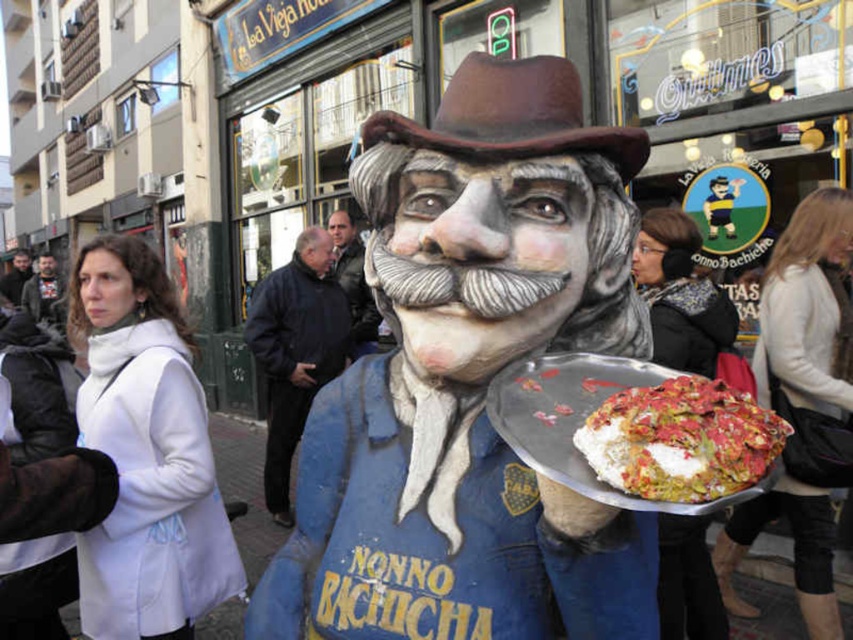
Question: Estimate the real-world distances between objects in this image. Which object is farther from the matte blue statue at center?

Choices:
 (A) white creamy pizza at center
 (B) white sweater at center
 (C) dark brown leather jacket at center
 (D) dark gray fabric jacket at left

Answer: (C)

Question: Can you confirm if smooth leather jacket at center is positioned below dark brown leather jacket at center?

Choices:
 (A) no
 (B) yes

Answer: (B)

Question: Which point is farther to the camera?

Choices:
 (A) (486, 70)
 (B) (697, 472)

Answer: (A)

Question: Where is white woolen coat at left located in relation to white creamy pizza at center in the image?

Choices:
 (A) left
 (B) right

Answer: (A)

Question: Which object is positioned farthest from the matte blue statue at center?

Choices:
 (A) dark brown leather jacket at center
 (B) white sweater at center

Answer: (A)

Question: Is black leather jacket at center thinner than smooth leather jacket at center?

Choices:
 (A) no
 (B) yes

Answer: (B)